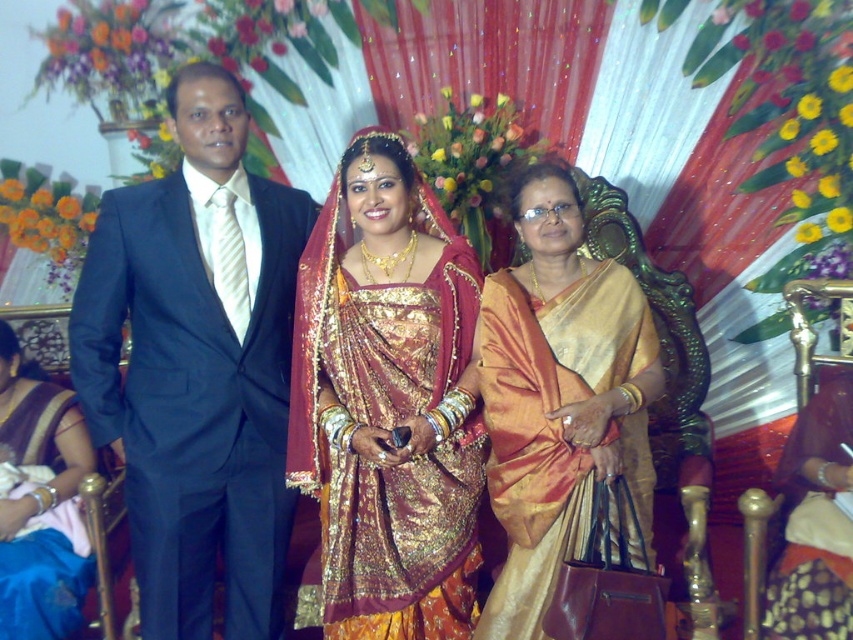
You are a photographer at a wedding and need to adjust the lighting to ensure both the shiny silk saree at center and the silky blue saree at lower left are well lit. Considering their sizes, which saree might require more focused lighting to highlight its details?

The shiny silk saree at center requires more focused lighting because its width is larger than the silky blue saree at lower left, making it necessary to ensure all details are properly illuminated.

You are a photographer at this event and want to capture a photo that includes both the silky gold sari at center and the silky blue saree at lower left. Which sari will appear larger in the photo?

The silky gold sari at center will appear larger in the photo because it is closer to the viewer than the silky blue saree at lower left.

Based on the scene described, which of the two saris, the silky gold sari at center or the silky blue saree at lower left, is positioned higher in the image?

The silky gold sari at center is positioned higher in the image as it is much taller than the silky blue saree at lower left.